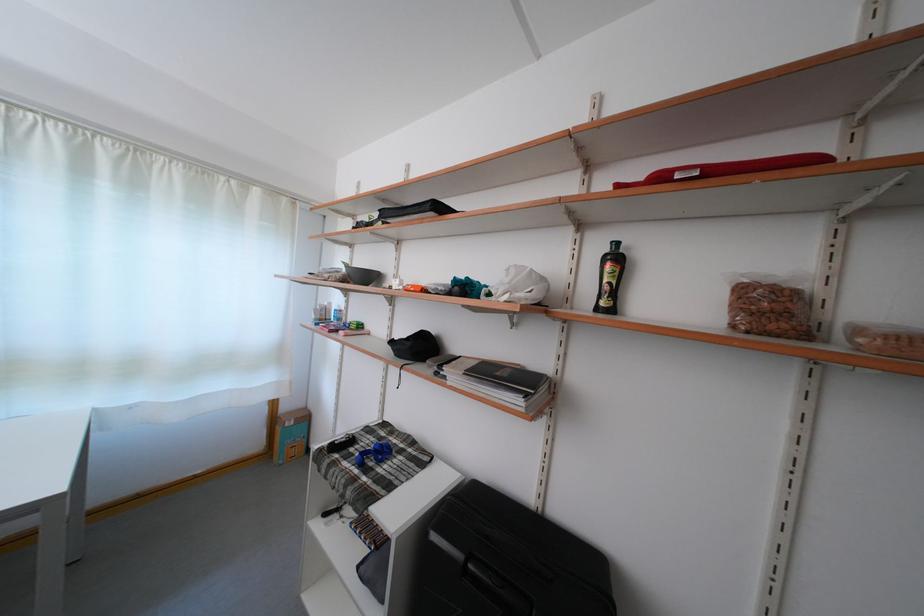
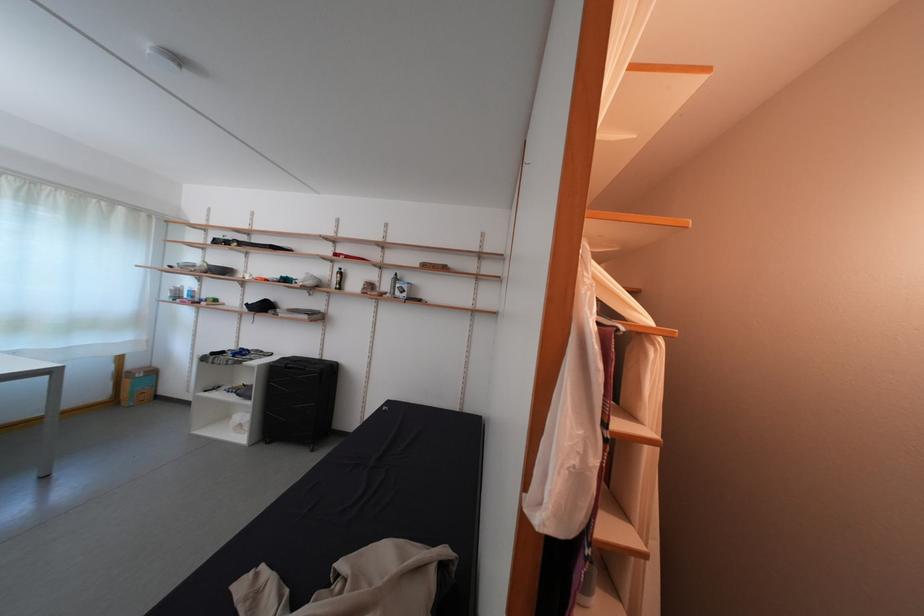
Where in the second image is the point corresponding to the point at 581,292 from the first image?

(339, 286)